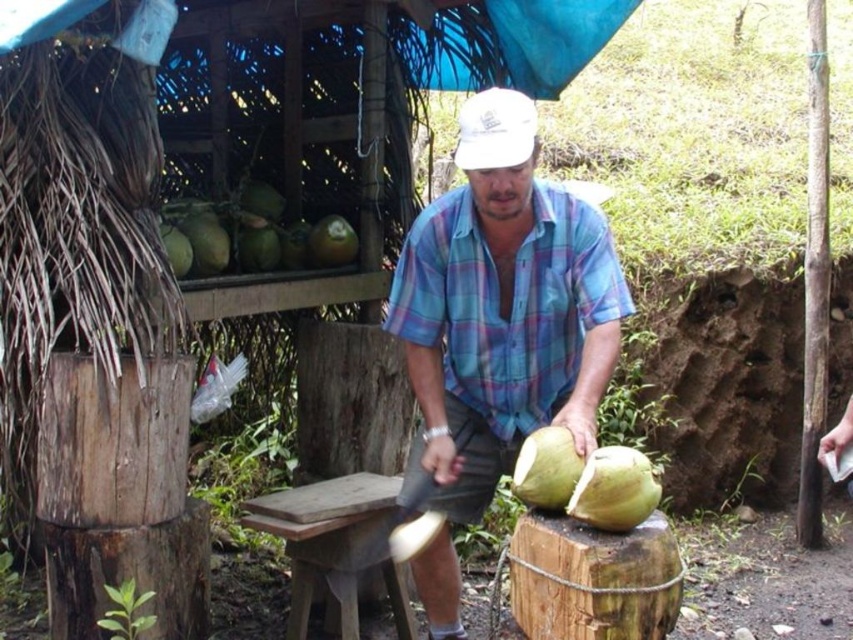
Is point (560, 480) closer to camera compared to point (328, 237)?

Yes.

Locate an element on the screen. Image resolution: width=853 pixels, height=640 pixels. green rough coconut at center is located at coordinates (546, 468).

Between blue plaid shirt at center and green rough coconut at center, which one has more height?

With more height is blue plaid shirt at center.

Does point (515, 300) come farther from viewer compared to point (538, 493)?

Yes, point (515, 300) is behind point (538, 493).

Locate an element on the screen. blue plaid shirt at center is located at coordinates (502, 310).

Does blue plaid shirt at center have a greater height compared to white matte baseball cap at center?

Indeed, blue plaid shirt at center has a greater height compared to white matte baseball cap at center.

Is blue plaid shirt at center smaller than white matte baseball cap at center?

No.

Is point (585, 385) more distant than point (497, 160)?

Yes, it is.

Where is `blue plaid shirt at center`? This screenshot has width=853, height=640. blue plaid shirt at center is located at coordinates (502, 310).